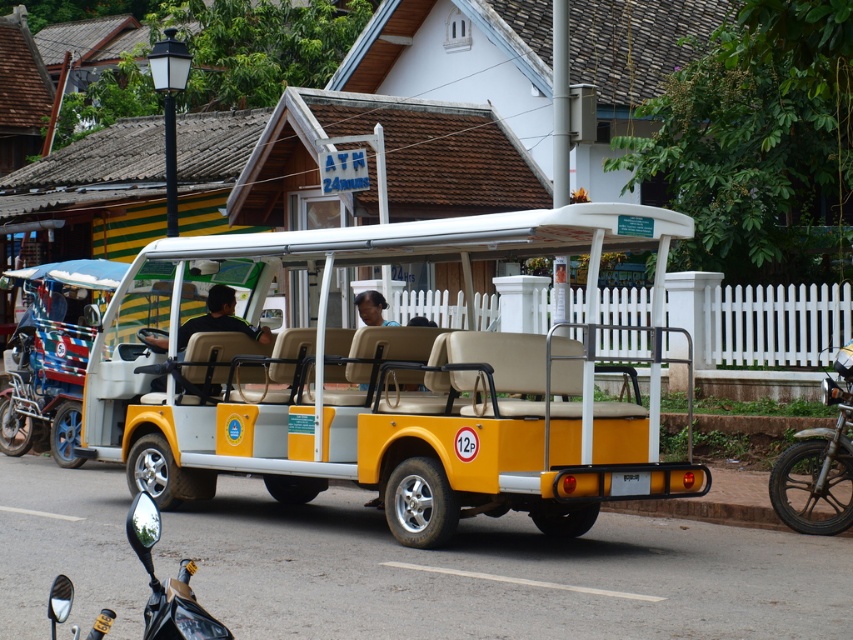
You are standing at the entrance of the street and want to locate the black matte shirt at center. According to the coordinate system where the bottom left corner is the origin, which direction should you look to find it?

The black matte shirt at center is located at coordinate point (219, 317). Since the y coordinate is 0.259, which is closer to the bottom, you should look upward from the bottom to find it.

You are a delivery person who needs to load a package onto the yellow matte golf cart at center and the metallic silver motorcycle at right. Which vehicle will require a higher platform to load the package?

The yellow matte golf cart at center has a greater height compared to the metallic silver motorcycle at right, so the yellow matte golf cart at center will require a higher platform to load the package.